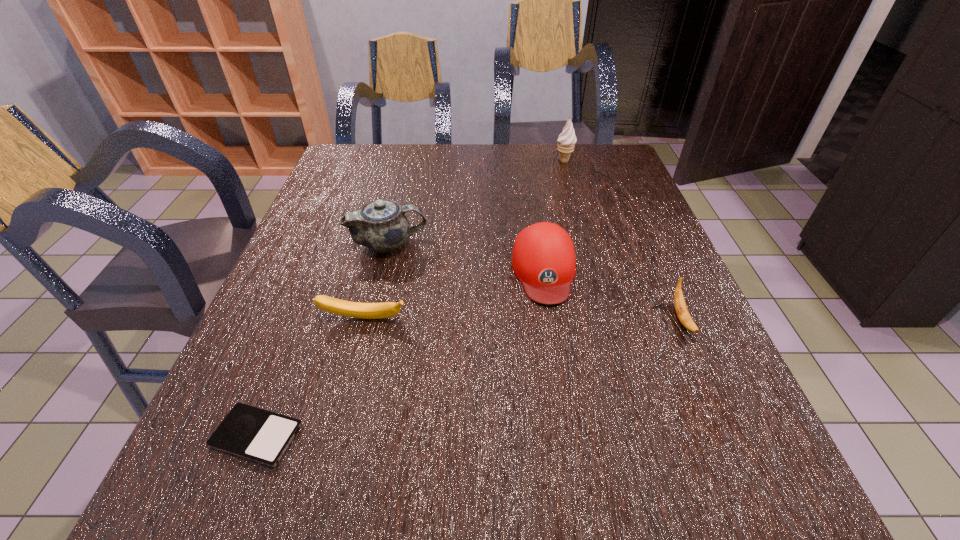
The height and width of the screenshot is (540, 960). What are the coordinates of `banana that is at the left edge` in the screenshot? It's located at (333, 305).

Locate an element on the screen. iPod located in the left edge section of the desktop is located at coordinates (262, 436).

Locate an element on the screen. icecream located in the right edge section of the desktop is located at coordinates (566, 140).

Locate an element on the screen. The height and width of the screenshot is (540, 960). banana that is positioned at the right edge is located at coordinates (681, 309).

I want to click on object located at the near left corner, so click(x=262, y=436).

Where is `object present at the far right corner`? object present at the far right corner is located at coordinates (566, 140).

Where is `free space at the near edge of the desktop`? free space at the near edge of the desktop is located at coordinates (577, 529).

In the image, there is a desktop. Identify the location of vacant space at the left edge. (281, 338).

Find the location of `free space at the right edge of the desktop`. free space at the right edge of the desktop is located at coordinates 612,226.

At what (x,y) coordinates should I click in order to perform the action: click on vacant space at the far left corner of the desktop. Please return your answer as a coordinate pair (x, y). Looking at the image, I should click on [x=349, y=151].